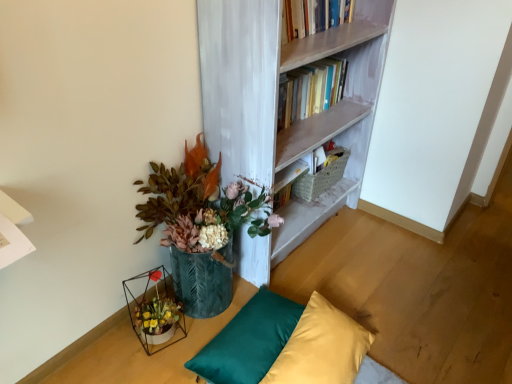
Question: Is teal satin pillow at lower center, placed as the second pillow when sorted from right to left, wider than silky yellow pillow at lower center, placed as the 2th pillow when sorted from left to right?

Choices:
 (A) no
 (B) yes

Answer: (A)

Question: Is teal satin pillow at lower center, placed as the second pillow when sorted from right to left, to the right of silky yellow pillow at lower center, which appears as the 1th pillow when viewed from the right, from the viewer's perspective?

Choices:
 (A) no
 (B) yes

Answer: (A)

Question: Is teal satin pillow at lower center, placed as the second pillow when sorted from right to left, in front of silky yellow pillow at lower center, which appears as the 1th pillow when viewed from the right?

Choices:
 (A) yes
 (B) no

Answer: (B)

Question: From the image's perspective, would you say teal satin pillow at lower center, placed as the second pillow when sorted from right to left, is shown under silky yellow pillow at lower center, which appears as the 1th pillow when viewed from the right?

Choices:
 (A) no
 (B) yes

Answer: (A)

Question: From a real-world perspective, does teal satin pillow at lower center, the 1th pillow in the left-to-right sequence, sit lower than silky yellow pillow at lower center, which appears as the 1th pillow when viewed from the right?

Choices:
 (A) yes
 (B) no

Answer: (A)

Question: From a real-world perspective, is silky yellow pillow at lower center, placed as the 2th pillow when sorted from left to right, positioned above or below teal satin pillow at lower center, the 1th pillow in the left-to-right sequence?

Choices:
 (A) below
 (B) above

Answer: (B)

Question: Considering the positions of silky yellow pillow at lower center, which appears as the 1th pillow when viewed from the right, and teal satin pillow at lower center, the 1th pillow in the left-to-right sequence, in the image, is silky yellow pillow at lower center, which appears as the 1th pillow when viewed from the right, bigger or smaller than teal satin pillow at lower center, the 1th pillow in the left-to-right sequence,?

Choices:
 (A) small
 (B) big

Answer: (B)

Question: In the image, is silky yellow pillow at lower center, placed as the 2th pillow when sorted from left to right, on the left side or the right side of teal satin pillow at lower center, the 1th pillow in the left-to-right sequence?

Choices:
 (A) left
 (B) right

Answer: (B)

Question: Is silky yellow pillow at lower center, placed as the 2th pillow when sorted from left to right, taller or shorter than teal satin pillow at lower center, placed as the second pillow when sorted from right to left?

Choices:
 (A) tall
 (B) short

Answer: (A)

Question: Is metallic wire table at lower left to the left or to the right of metallic green vase at lower left in the image?

Choices:
 (A) right
 (B) left

Answer: (B)

Question: Is metallic wire table at lower left in front of or behind metallic green vase at lower left in the image?

Choices:
 (A) front
 (B) behind

Answer: (B)

Question: Choose the correct answer: Is metallic wire table at lower left inside metallic green vase at lower left or outside it?

Choices:
 (A) outside
 (B) inside

Answer: (A)

Question: From the image's perspective, is metallic wire table at lower left positioned above or below metallic green vase at lower left?

Choices:
 (A) below
 (B) above

Answer: (A)

Question: From a real-world perspective, is silky yellow pillow at lower center, placed as the 2th pillow when sorted from left to right, positioned above or below metallic green vase at lower left?

Choices:
 (A) above
 (B) below

Answer: (B)

Question: From their relative heights in the image, would you say silky yellow pillow at lower center, which appears as the 1th pillow when viewed from the right, is taller or shorter than metallic green vase at lower left?

Choices:
 (A) tall
 (B) short

Answer: (B)